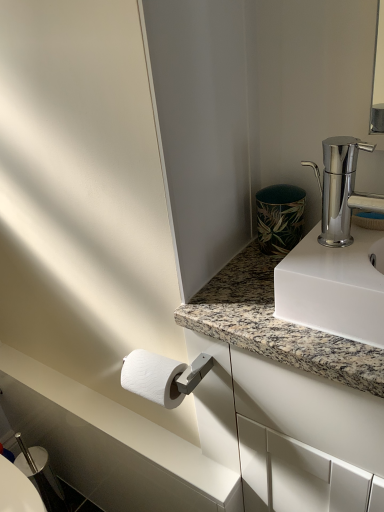
Question: From a real-world perspective, is white textured toilet paper at lower left physically located above or below white marble countertop at lower left?

Choices:
 (A) below
 (B) above

Answer: (B)

Question: Do you think white textured toilet paper at lower left is within white marble countertop at lower left, or outside of it?

Choices:
 (A) inside
 (B) outside

Answer: (B)

Question: Which of these objects is positioned farthest from the white textured toilet paper at lower left?

Choices:
 (A) polished chrome faucet at upper right
 (B) green leaf-patterned ceramic at upper right
 (C) white marble countertop at lower left
 (D) granite at upper right
 (E) silver metallic bidet at lower left

Answer: (A)

Question: Which object is positioned farthest from the white textured toilet paper at lower left?

Choices:
 (A) green leaf-patterned ceramic at upper right
 (B) white marble countertop at lower left
 (C) granite at upper right
 (D) polished chrome faucet at upper right
 (E) silver metallic bidet at lower left

Answer: (D)